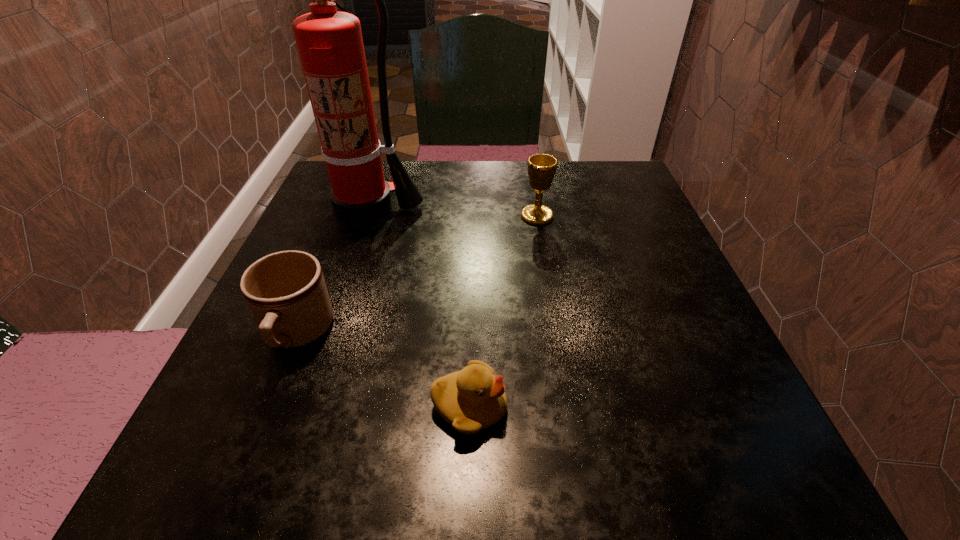
You are a GUI agent. You are given a task and a screenshot of the screen. Output one action in this format:
    pyautogui.click(x=<x>, y=<y>)
    Task: Click on the fire extinguisher at the far edge
    Image resolution: width=960 pixels, height=540 pixels.
    Given the screenshot: What is the action you would take?
    pyautogui.click(x=330, y=45)

Find the location of a particular element. The image size is (960, 540). chalice that is at the far edge is located at coordinates 541,169.

Where is `object that is at the near edge`? object that is at the near edge is located at coordinates (472, 399).

Find the location of a particular element. This screenshot has width=960, height=540. fire extinguisher located at the left edge is located at coordinates (330, 45).

The width and height of the screenshot is (960, 540). In order to click on mug located at the left edge in this screenshot , I will do `click(286, 292)`.

Locate an element on the screen. The width and height of the screenshot is (960, 540). object present at the far left corner is located at coordinates (330, 45).

Identify the location of free region at the far edge of the desktop. The image size is (960, 540). (459, 161).

The width and height of the screenshot is (960, 540). I want to click on blank space at the near edge, so click(336, 435).

In the image, there is a desktop. Where is `free space at the left edge`? The height and width of the screenshot is (540, 960). free space at the left edge is located at coordinates (282, 379).

In the image, there is a desktop. In order to click on vacant space at the right edge in this screenshot , I will do `click(605, 302)`.